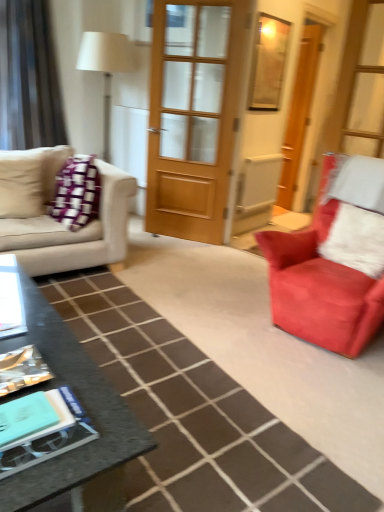
Where is `vacant region to the left of suede red armchair at right`? vacant region to the left of suede red armchair at right is located at coordinates (192, 311).